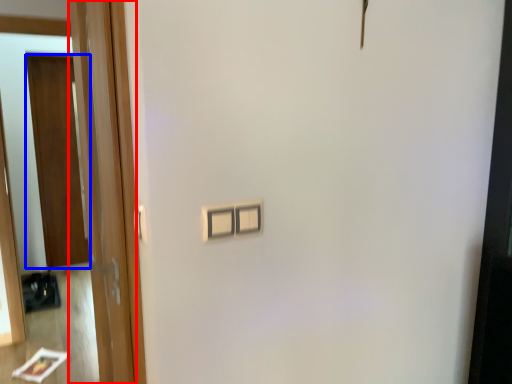
Question: Among these objects, which one is farthest to the camera, door (highlighted by a red box) or door (highlighted by a blue box)?

Choices:
 (A) door
 (B) door

Answer: (B)